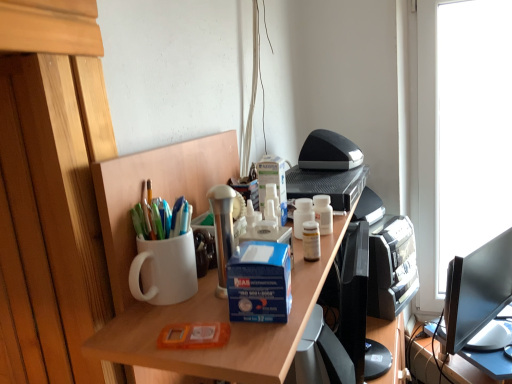
Where is `free space to the right of orange plastic case at center, arranged as the first stationery when ordered from the bottom`? Image resolution: width=512 pixels, height=384 pixels. free space to the right of orange plastic case at center, arranged as the first stationery when ordered from the bottom is located at coordinates (270, 326).